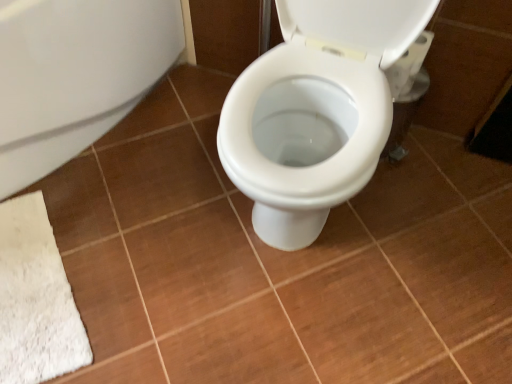
Question: In terms of width, does white matte toilet paper at upper right look wider or thinner when compared to white matte bath at lower left?

Choices:
 (A) thin
 (B) wide

Answer: (A)

Question: Is point (415, 62) positioned closer to the camera than point (117, 71)?

Choices:
 (A) farther
 (B) closer

Answer: (B)

Question: From a real-world perspective, is white matte toilet paper at upper right physically located above or below white matte bath at lower left?

Choices:
 (A) below
 (B) above

Answer: (B)

Question: From their relative heights in the image, would you say white matte bath at lower left is taller or shorter than white matte toilet paper at upper right?

Choices:
 (A) short
 (B) tall

Answer: (B)

Question: Looking at their shapes, would you say white matte bath at lower left is wider or thinner than white matte toilet paper at upper right?

Choices:
 (A) wide
 (B) thin

Answer: (A)

Question: From a real-world perspective, is white matte bath at lower left above or below white matte toilet paper at upper right?

Choices:
 (A) above
 (B) below

Answer: (B)

Question: From the image's perspective, is white matte bath at lower left positioned above or below white matte toilet paper at upper right?

Choices:
 (A) above
 (B) below

Answer: (B)